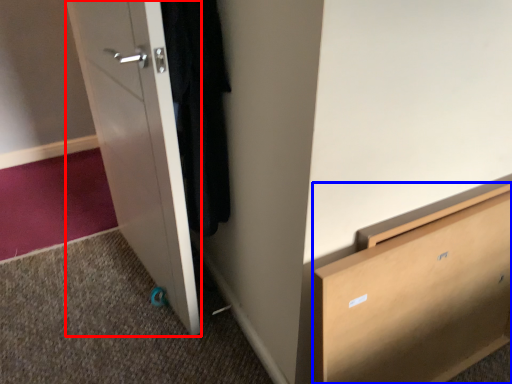
Question: Which object appears closest to the camera in this image, door (highlighted by a red box) or chest of drawers (highlighted by a blue box)?

Choices:
 (A) door
 (B) chest of drawers

Answer: (B)